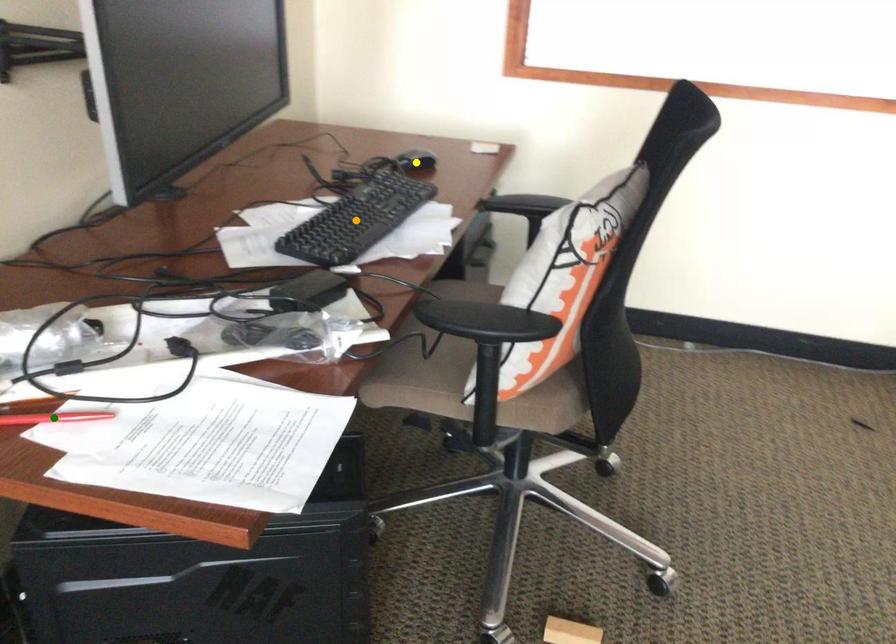
Order these from nearest to farthest:
green point
orange point
yellow point

green point < orange point < yellow point